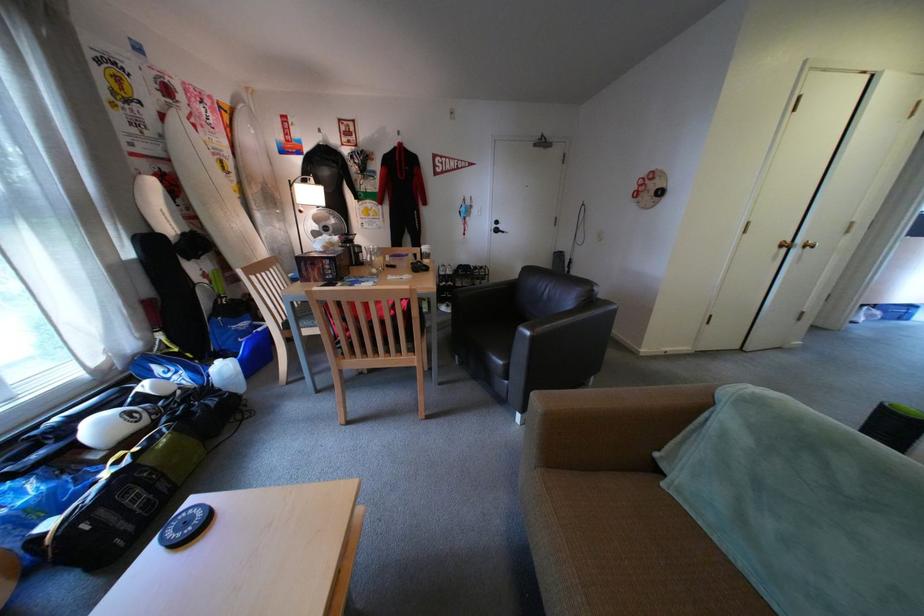
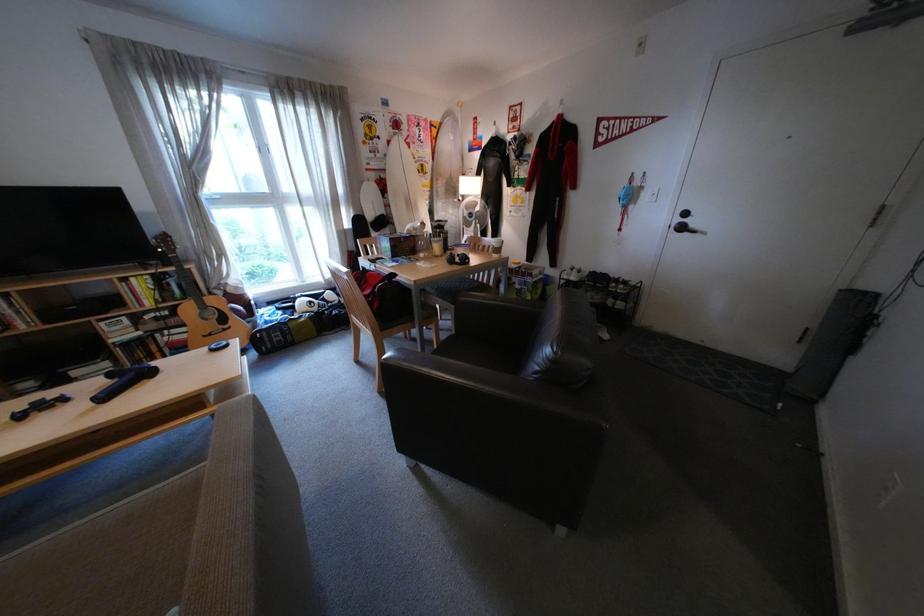
In the second image, find the point that corresponds to [351,243] in the first image.

(433, 228)